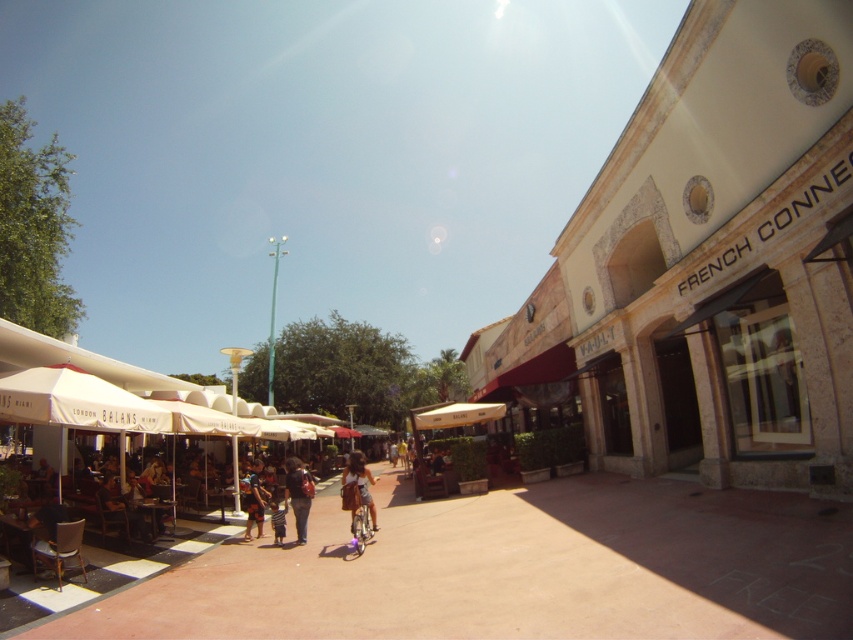
Question: Observing the image, what is the correct spatial positioning of matte black backpack at center in reference to blue denim shorts at center?

Choices:
 (A) below
 (B) above

Answer: (B)

Question: Based on their relative distances, which object is nearer to the blue denim shorts at center?

Choices:
 (A) matte black backpack at center
 (B) white fabric canopy at center
 (C) denim jacket at center

Answer: (A)

Question: Which object is the closest to the white fabric canopy at center?

Choices:
 (A) matte black backpack at center
 (B) blue denim shorts at center

Answer: (B)

Question: Which point is farther to the camera?

Choices:
 (A) blue denim shorts at center
 (B) white fabric canopy at center
 (C) matte black backpack at center
 (D) denim jacket at center

Answer: (B)

Question: Does matte black backpack at center have a greater width compared to blue denim shorts at center?

Choices:
 (A) yes
 (B) no

Answer: (A)

Question: Observing the image, what is the correct spatial positioning of matte black backpack at center in reference to blue denim shorts at center?

Choices:
 (A) left
 (B) right

Answer: (B)